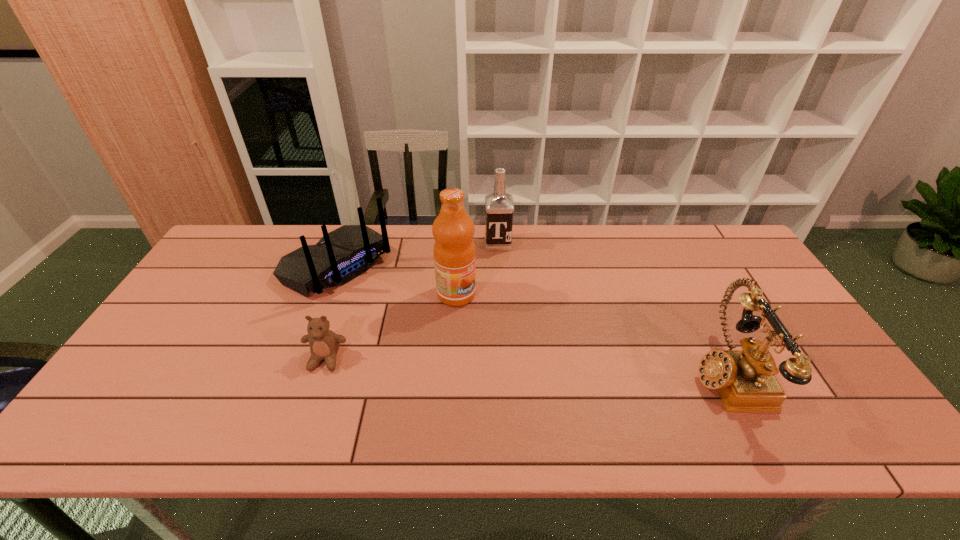
This screenshot has width=960, height=540. I want to click on router present at the far edge, so click(343, 254).

Identify the location of object at the near edge. pyautogui.click(x=745, y=380).

The image size is (960, 540). What are the coordinates of `free space at the far edge of the desktop` in the screenshot? It's located at (671, 243).

Image resolution: width=960 pixels, height=540 pixels. I want to click on free space at the near edge, so click(455, 377).

In the image, there is a desktop. Where is `free space at the left edge`? The image size is (960, 540). free space at the left edge is located at coordinates (224, 319).

In the image, there is a desktop. Where is `free space at the far right corner`? This screenshot has height=540, width=960. free space at the far right corner is located at coordinates (736, 246).

The height and width of the screenshot is (540, 960). I want to click on free spot between the teddy bear and the vodka, so click(412, 301).

This screenshot has height=540, width=960. Identify the location of empty location between the tallest object and the teddy bear. (391, 327).

At what (x,y) coordinates should I click in order to perform the action: click on empty space between the rightmost object and the tallest object. Please return your answer as a coordinate pair (x, y). This screenshot has width=960, height=540. Looking at the image, I should click on (590, 333).

The width and height of the screenshot is (960, 540). In order to click on free space between the router and the telephone in this screenshot , I will do `click(532, 319)`.